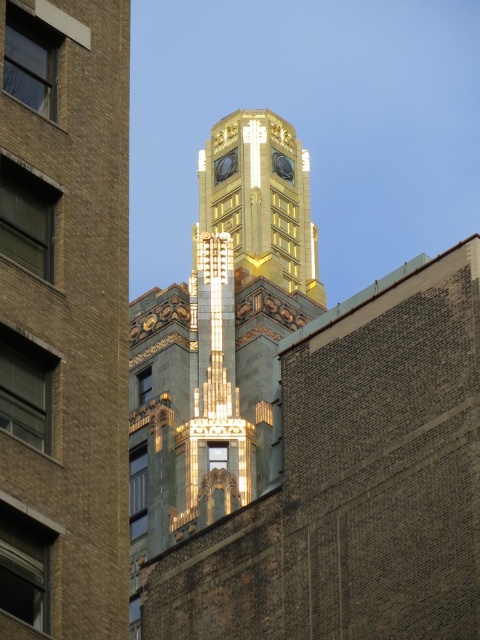
You are an architect examining the building details. You notice two gold metallic structures at the center of the image. Which one is taller between the gold metallic clock tower at center and the gold metallic bell tower at center?

The gold metallic clock tower at center is taller than the gold metallic bell tower at center according to the description.

You are an architect analyzing the central structure of the image. You observe the gold metallic clock tower at center and the gold metallic bell tower at center. Which one is located to the right when viewed from the front?

The gold metallic clock tower at center is positioned on the right side of the gold metallic bell tower at center, so it is located to the right.